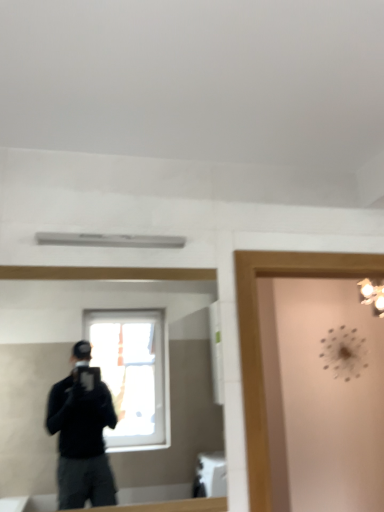
Question: From a real-world perspective, is clear glass mirror at center physically located above or below transparent glass door at upper right?

Choices:
 (A) below
 (B) above

Answer: (B)

Question: In the image, is clear glass mirror at center on the left side or the right side of transparent glass door at upper right?

Choices:
 (A) left
 (B) right

Answer: (A)

Question: Is clear glass mirror at center bigger or smaller than transparent glass door at upper right?

Choices:
 (A) small
 (B) big

Answer: (A)

Question: From the image's perspective, is transparent glass door at upper right above or below clear glass mirror at center?

Choices:
 (A) above
 (B) below

Answer: (B)

Question: Is transparent glass door at upper right in front of or behind clear glass mirror at center in the image?

Choices:
 (A) front
 (B) behind

Answer: (B)

Question: Considering the positions of point (251, 413) and point (172, 413), is point (251, 413) closer or farther from the camera than point (172, 413)?

Choices:
 (A) closer
 (B) farther

Answer: (A)

Question: Considering the relative positions of transparent glass door at upper right and clear glass mirror at center in the image provided, is transparent glass door at upper right to the left or to the right of clear glass mirror at center?

Choices:
 (A) left
 (B) right

Answer: (B)